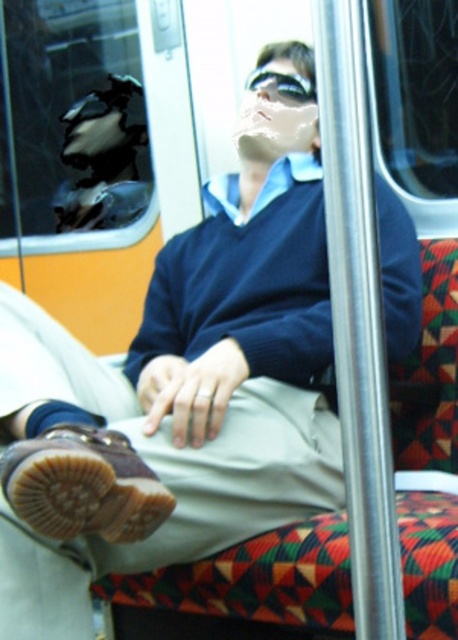
Question: Is brown suede shoe at lower left below clear plastic goggles at upper center?

Choices:
 (A) no
 (B) yes

Answer: (B)

Question: Can you confirm if brown suede shoe at lower left is bigger than clear plastic goggles at upper center?

Choices:
 (A) yes
 (B) no

Answer: (A)

Question: Which of the following is the closest to the observer?

Choices:
 (A) (164, 508)
 (B) (304, 99)

Answer: (A)

Question: Which object appears closest to the camera in this image?

Choices:
 (A) clear plastic goggles at upper center
 (B) brown suede shoe at lower left

Answer: (B)

Question: From the image, what is the correct spatial relationship of brown suede shoe at lower left in relation to clear plastic goggles at upper center?

Choices:
 (A) left
 (B) right

Answer: (A)